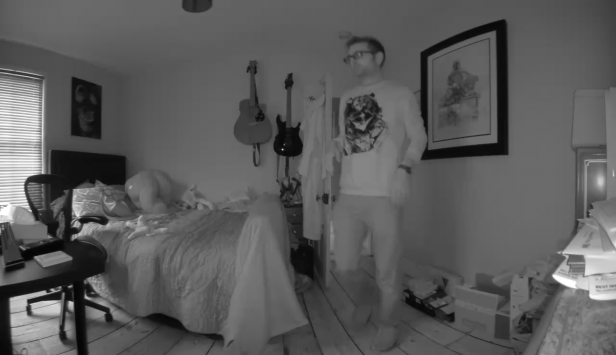
This screenshot has width=616, height=355. Identify the location of blanket. (196, 244).